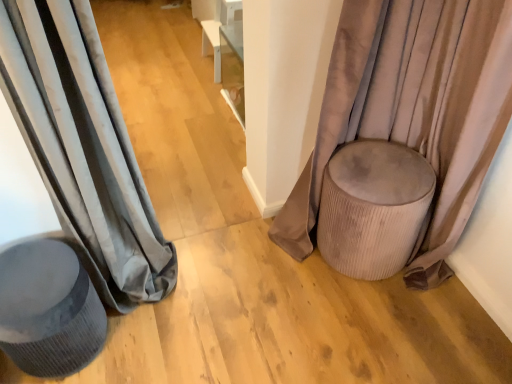
The image size is (512, 384). I want to click on free space in front of suede beige ottoman at right, so click(x=374, y=329).